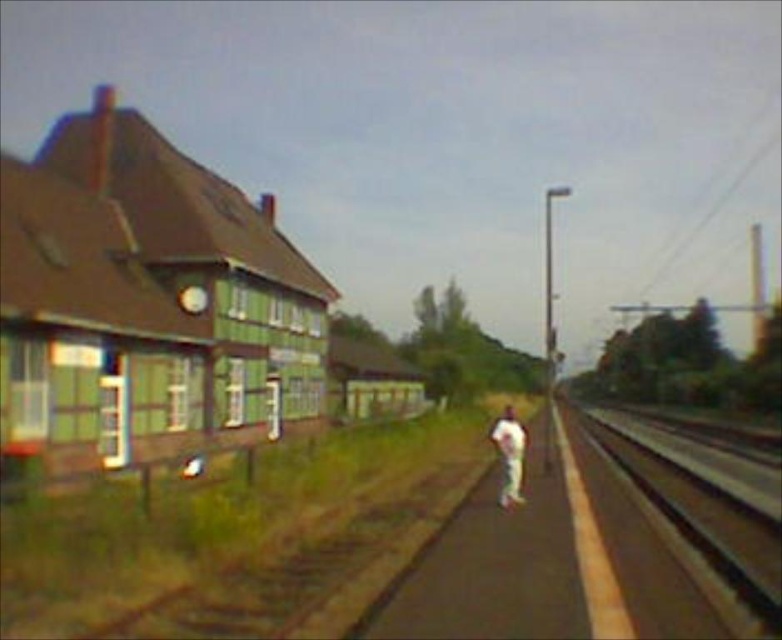
Consider the image. Based on the scene, where is the smooth asphalt train track at right located in the image?

The smooth asphalt train track at right is located at point (x=698, y=524) in the image.

You are standing on the paved pathway next to the traditional building. You want to place a small potted plant between the smooth asphalt train track at right and the white cotton pants at center. Which object should the plant be closer to to ensure it fits within the available space?

The smooth asphalt train track at right is larger in size than the white cotton pants at center, so the plant should be placed closer to the white cotton pants at center to fit within the smaller space.